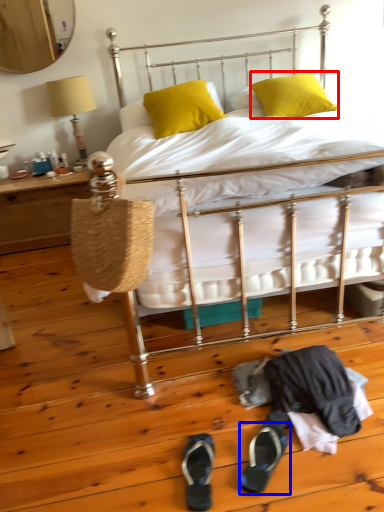
Question: Which of the following is the closest to the observer, pillow (highlighted by a red box) or footwear (highlighted by a blue box)?

Choices:
 (A) pillow
 (B) footwear

Answer: (B)